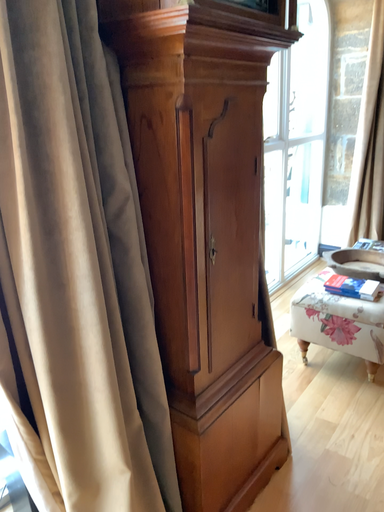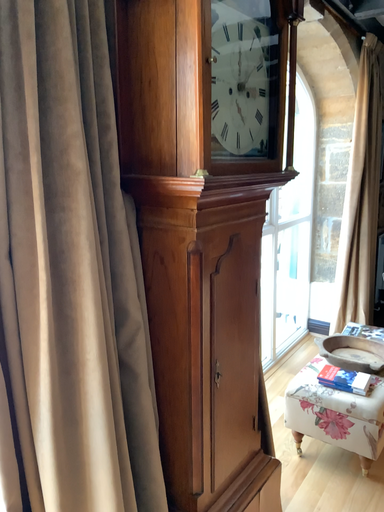
Question: Which way did the camera rotate in the video?

Choices:
 (A) rotated upward
 (B) rotated downward

Answer: (A)